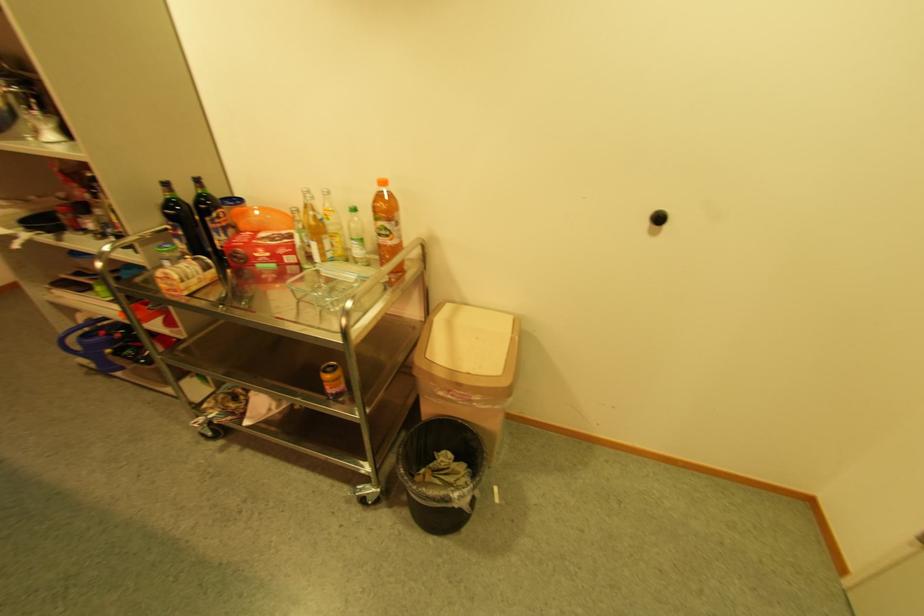
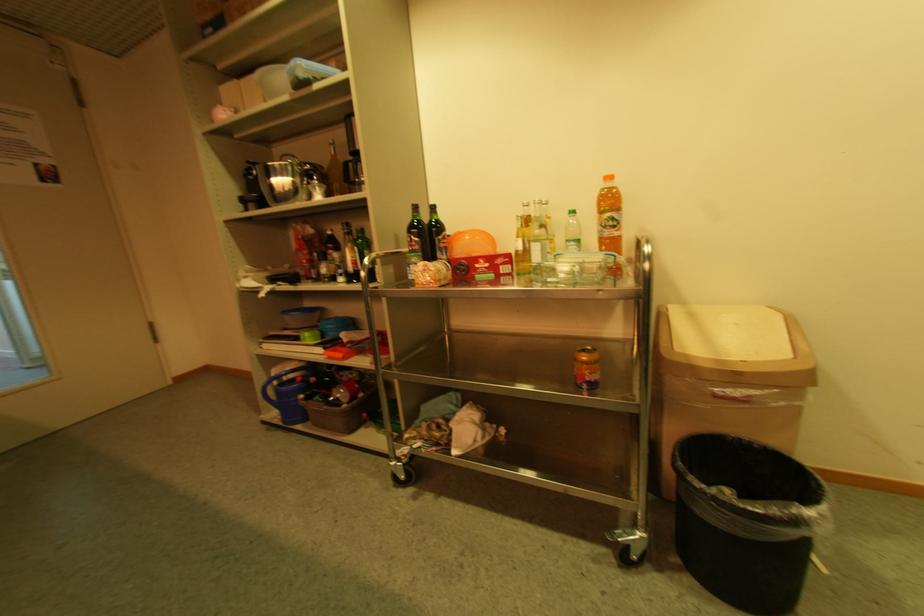
Question: How did the camera likely rotate?

Choices:
 (A) Left
 (B) Right
 (C) Up
 (D) Down

Answer: (C)